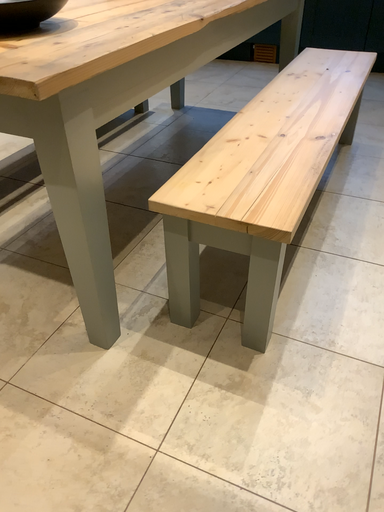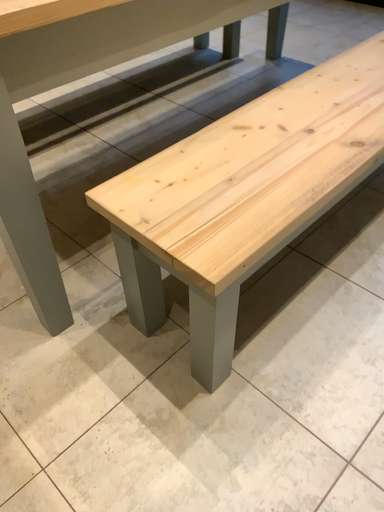
Question: How did the camera likely rotate when shooting the video?

Choices:
 (A) rotated upward
 (B) rotated downward

Answer: (B)